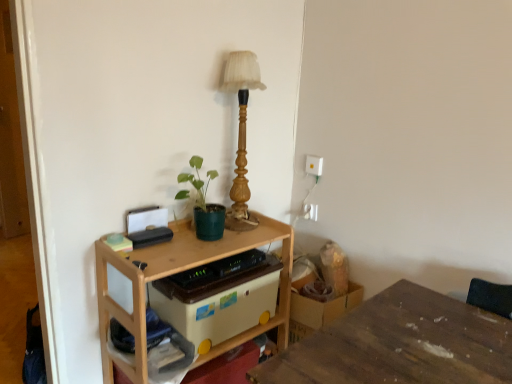
Question: Does wooden table at center, the first table positioned from the left, have a lesser width compared to green matte plant at center?

Choices:
 (A) no
 (B) yes

Answer: (A)

Question: From a real-world perspective, is wooden table at center, arranged as the 2th table when viewed from the right, under green matte plant at center?

Choices:
 (A) yes
 (B) no

Answer: (A)

Question: Considering the relative sizes of wooden table at center, the first table positioned from the left, and green matte plant at center in the image provided, is wooden table at center, the first table positioned from the left, smaller than green matte plant at center?

Choices:
 (A) yes
 (B) no

Answer: (B)

Question: Does wooden table at center, arranged as the 2th table when viewed from the right, have a greater width compared to green matte plant at center?

Choices:
 (A) no
 (B) yes

Answer: (B)

Question: Is wooden table at center, arranged as the 2th table when viewed from the right, touching green matte plant at center?

Choices:
 (A) no
 (B) yes

Answer: (A)

Question: From a real-world perspective, does wooden table at center, the first table positioned from the left, stand above green matte plant at center?

Choices:
 (A) no
 (B) yes

Answer: (A)

Question: Is green matte plant at center placed right next to white plastic electric outlet at upper right, the first electric outlet ordered from the bottom?

Choices:
 (A) yes
 (B) no

Answer: (B)

Question: Considering the relative sizes of green matte plant at center and white plastic electric outlet at upper right, the first electric outlet ordered from the bottom, in the image provided, is green matte plant at center taller than white plastic electric outlet at upper right, the first electric outlet ordered from the bottom,?

Choices:
 (A) no
 (B) yes

Answer: (B)

Question: Is green matte plant at center to the right of white plastic electric outlet at upper right, the first electric outlet ordered from the bottom, from the viewer's perspective?

Choices:
 (A) no
 (B) yes

Answer: (A)

Question: From a real-world perspective, is green matte plant at center physically above white plastic electric outlet at upper right, the 2th electric outlet from the top?

Choices:
 (A) yes
 (B) no

Answer: (A)

Question: Does green matte plant at center have a larger size compared to white plastic electric outlet at upper right, the first electric outlet ordered from the bottom?

Choices:
 (A) yes
 (B) no

Answer: (A)

Question: Does green matte plant at center turn towards white plastic electric outlet at upper right, the 2th electric outlet from the top?

Choices:
 (A) yes
 (B) no

Answer: (B)

Question: Is beige plastic storage box at center turned away from wooden table lamp at upper center?

Choices:
 (A) yes
 (B) no

Answer: (B)